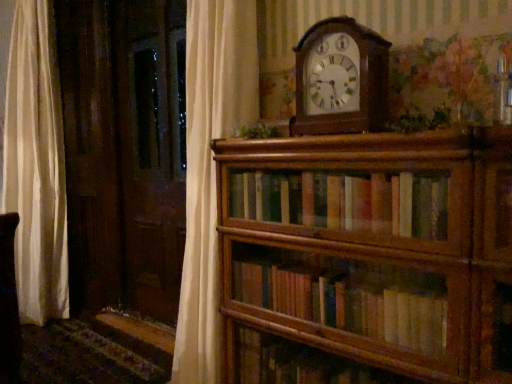
Question: Is green leafy plant at upper center, positioned as the 1th plant in front-to-back order, taller or shorter than green leafy plant at upper center, placed as the 1th plant when sorted from left to right?

Choices:
 (A) short
 (B) tall

Answer: (B)

Question: Do you think green leafy plant at upper center, which appears as the 2th plant when viewed from the left, is within green leafy plant at upper center, which is the 2th plant in right-to-left order, or outside of it?

Choices:
 (A) outside
 (B) inside

Answer: (A)

Question: Which object is the closest to the wooden wall clock at upper center?

Choices:
 (A) wooden bookshelf at center
 (B) green leafy plant at upper center, the first plant viewed from the right
 (C) green leafy plant at upper center, the second plant in the front-to-back sequence

Answer: (B)

Question: Which is farther from the green leafy plant at upper center, which appears as the 2th plant when viewed from the left?

Choices:
 (A) wooden wall clock at upper center
 (B) green leafy plant at upper center, the second plant in the front-to-back sequence
 (C) wooden bookshelf at center

Answer: (B)